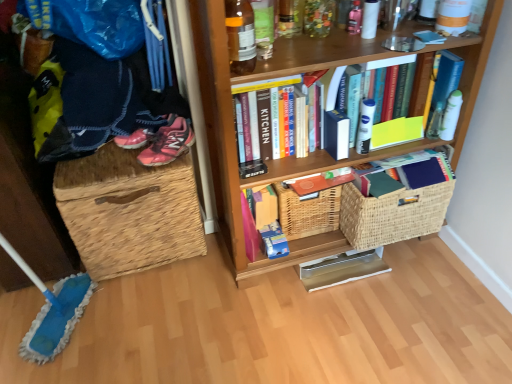
Where is `free point to the right of metallic gold book at lower center, positioned as the third book in top-to-bottom order`? free point to the right of metallic gold book at lower center, positioned as the third book in top-to-bottom order is located at coordinates (408, 271).